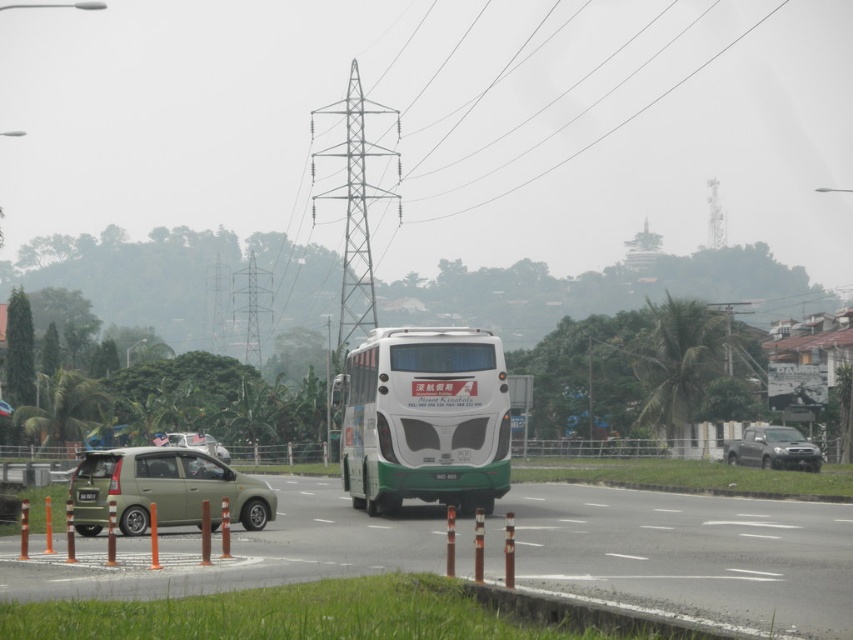
Question: Which point is farther to the camera?

Choices:
 (A) metallic silver car at center
 (B) black plastic license plate at center

Answer: (A)

Question: Does smokey gray metallic truck at right have a greater width compared to black plastic license plate at center?

Choices:
 (A) yes
 (B) no

Answer: (A)

Question: Which object is farther from the camera taking this photo?

Choices:
 (A) black plastic license plate at center
 (B) metallic silver car at center

Answer: (B)

Question: Is white matte bus at center thinner than smokey gray metallic truck at right?

Choices:
 (A) yes
 (B) no

Answer: (A)

Question: Can you confirm if smokey gray metallic truck at right is positioned to the right of black plastic license plate at center?

Choices:
 (A) no
 (B) yes

Answer: (B)

Question: Which object is farther from the camera taking this photo?

Choices:
 (A) matte green car at left
 (B) smokey gray metallic truck at right
 (C) metallic silver car at center

Answer: (C)